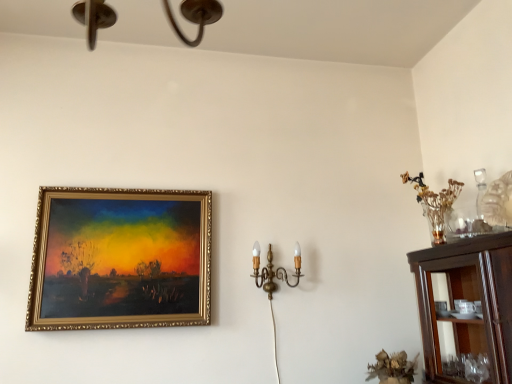
Question: Which is correct: gold ornate frame at upper left is inside gold brass wall sconce at center right, or outside of it?

Choices:
 (A) outside
 (B) inside

Answer: (A)

Question: Looking at their shapes, would you say gold ornate frame at upper left is wider or thinner than gold brass wall sconce at center right?

Choices:
 (A) thin
 (B) wide

Answer: (A)

Question: Which object is positioned closest to the gold ornate frame at upper left?

Choices:
 (A) gold brass wall sconce at center right
 (B) dark wood cabinet at right

Answer: (A)

Question: Estimate the real-world distances between objects in this image. Which object is closer to the gold ornate frame at upper left?

Choices:
 (A) gold brass wall sconce at center right
 (B) dark wood cabinet at right

Answer: (A)